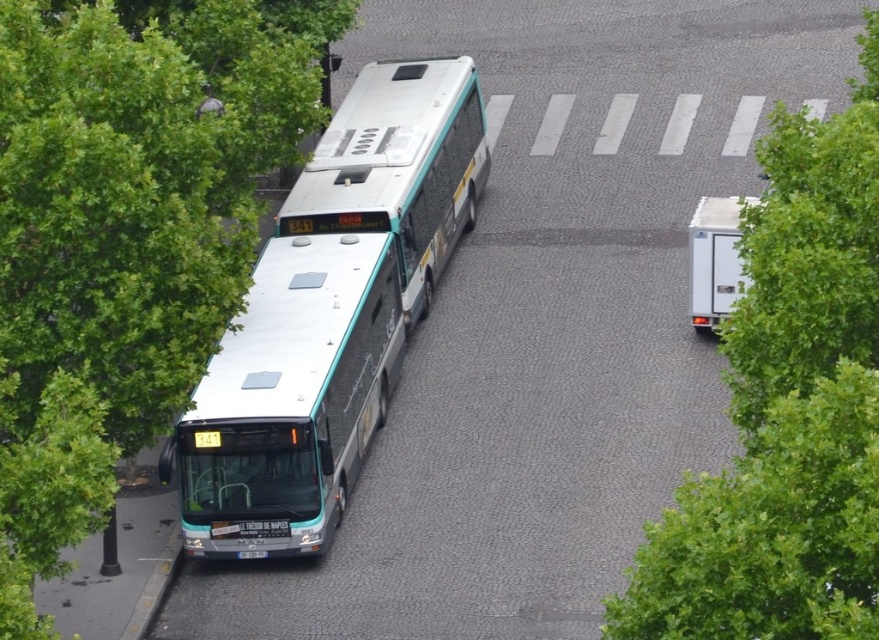
You are a delivery person trying to park your bike between the green leafy tree at center right and the white plastic box at right. Can you fit your bike there if your bike is 1 meter wide?

The green leafy tree at center right is wider than the white plastic box at right, but the exact width difference isn